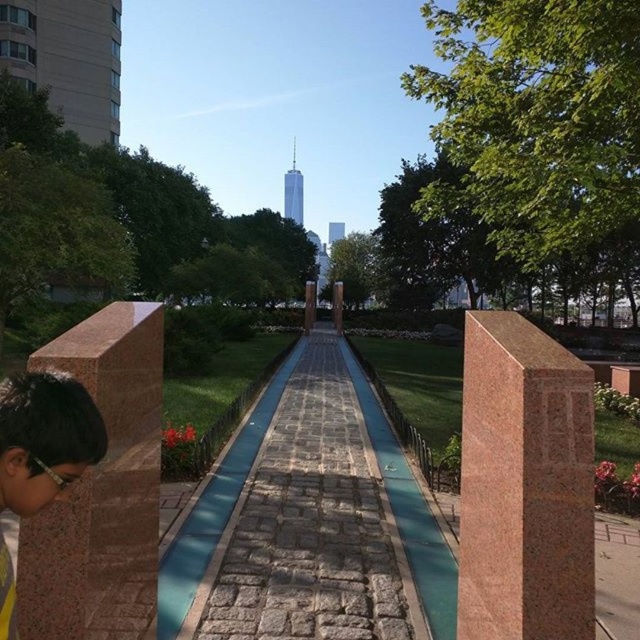
You are a painter standing at the edge of the stone paved walkway at center and want to paint the yellow fabric shirt at lower left. Which object is wider?

The stone paved walkway at center is wider than the yellow fabric shirt at lower left.

You are standing at the beginning of the pathway in the urban park scene. You see two points marked in the image. Which point is closer to you, point (241, 596) or point (81, 401)?

Point (81, 401) is closer to you because it is closer to the camera than point (241, 596).

Looking at this image, you are a delivery person carrying a box and need to cross the stone paved walkway at center. There is a yellow fabric shirt at lower left. What is the minimum width of the walkway required to safely pass without touching the shirt?

The minimum width required is at least 2.36 meters, as the distance between the stone paved walkway at center and the yellow fabric shirt at lower left is 2.36 meters.